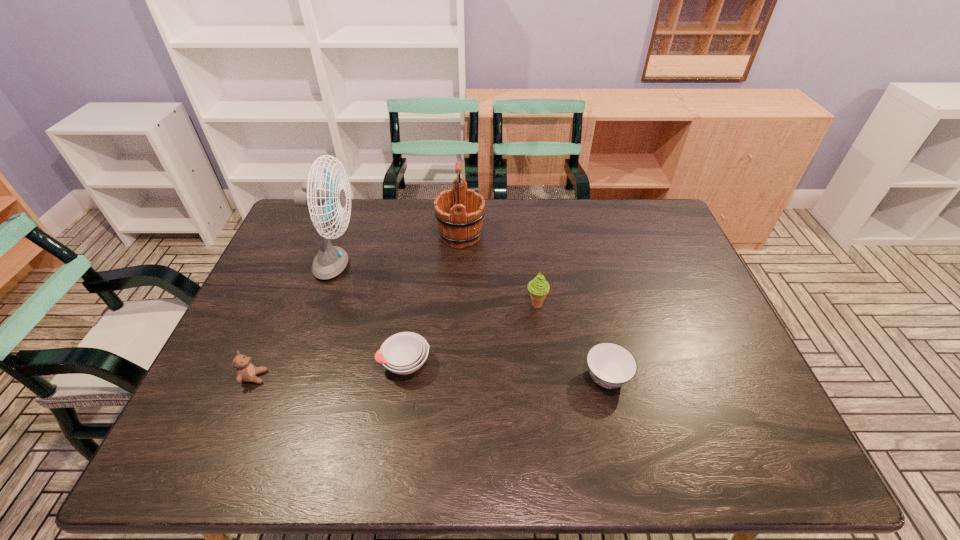
Where is `free location located on the left of the wine bucket`? The width and height of the screenshot is (960, 540). free location located on the left of the wine bucket is located at coordinates (386, 235).

Identify the location of free spot located on the back of the icecream. (525, 216).

Where is `vacant area situated 0.390m on the front-facing side of the third shortest object`? vacant area situated 0.390m on the front-facing side of the third shortest object is located at coordinates (425, 377).

Locate an element on the screen. Image resolution: width=960 pixels, height=540 pixels. free location located on the left of the right soup bowl is located at coordinates (422, 377).

Image resolution: width=960 pixels, height=540 pixels. I want to click on vacant area situated on the left of the left soup bowl, so click(255, 363).

I want to click on object that is at the far edge, so click(459, 211).

Find the location of a particular element. fan situated at the left edge is located at coordinates coord(330,261).

The image size is (960, 540). I want to click on teddy bear at the left edge, so click(245, 371).

In the image, there is a desktop. Identify the location of vacant space at the far edge. The width and height of the screenshot is (960, 540). (490, 225).

In order to click on free space at the near edge of the desktop in this screenshot , I will do `click(557, 433)`.